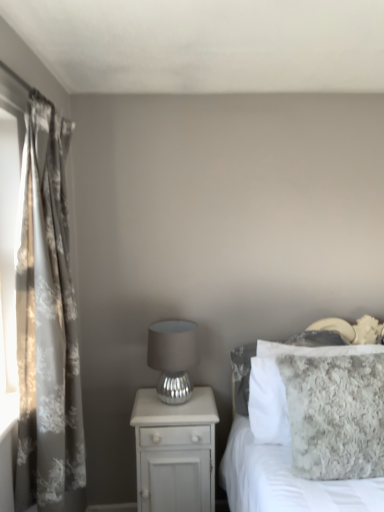
Question: Is matte silver table lamp at center completely or partially inside fuzzy gray blanket at right?

Choices:
 (A) yes
 (B) no

Answer: (B)

Question: Does fuzzy gray blanket at right have a lesser width compared to matte silver table lamp at center?

Choices:
 (A) yes
 (B) no

Answer: (B)

Question: Would you say fuzzy gray blanket at right is a long distance from matte silver table lamp at center?

Choices:
 (A) yes
 (B) no

Answer: (B)

Question: Can you confirm if fuzzy gray blanket at right is wider than matte silver table lamp at center?

Choices:
 (A) no
 (B) yes

Answer: (B)

Question: Is fuzzy gray blanket at right taller than matte silver table lamp at center?

Choices:
 (A) no
 (B) yes

Answer: (B)

Question: Is fuzzy gray blanket at right closer to camera compared to matte silver table lamp at center?

Choices:
 (A) yes
 (B) no

Answer: (A)

Question: From a real-world perspective, is white glossy nightstand at lower left positioned over matte silver table lamp at center based on gravity?

Choices:
 (A) yes
 (B) no

Answer: (B)

Question: Does white glossy nightstand at lower left have a lesser height compared to matte silver table lamp at center?

Choices:
 (A) yes
 (B) no

Answer: (B)

Question: Is white glossy nightstand at lower left next to matte silver table lamp at center and touching it?

Choices:
 (A) yes
 (B) no

Answer: (B)

Question: Can you confirm if white glossy nightstand at lower left is smaller than matte silver table lamp at center?

Choices:
 (A) no
 (B) yes

Answer: (A)

Question: Would you say matte silver table lamp at center is part of white glossy nightstand at lower left's contents?

Choices:
 (A) yes
 (B) no

Answer: (B)

Question: Does white glossy nightstand at lower left come in front of matte silver table lamp at center?

Choices:
 (A) no
 (B) yes

Answer: (A)

Question: Considering the relative sizes of fuzzy gray blanket at right and floral-patterned fabric curtain at left in the image provided, is fuzzy gray blanket at right smaller than floral-patterned fabric curtain at left?

Choices:
 (A) yes
 (B) no

Answer: (B)